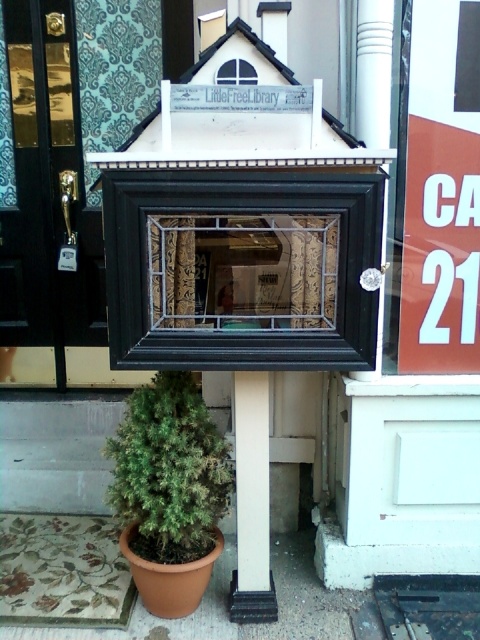
Question: Can you confirm if black wood frame at center is bigger than clear glass window at center?

Choices:
 (A) no
 (B) yes

Answer: (B)

Question: Among these points, which one is nearest to the camera?

Choices:
 (A) (182, 504)
 (B) (239, 67)
 (C) (236, 186)

Answer: (C)

Question: Which object is closer to the camera taking this photo?

Choices:
 (A) white smooth pillar at lower center
 (B) black wood frame at center
 (C) clear glass window at center
 (D) orange paper sign at right

Answer: (B)

Question: Does orange paper sign at right have a larger size compared to green matte plant at lower left?

Choices:
 (A) yes
 (B) no

Answer: (B)

Question: Is black wood frame at center to the left of white smooth pillar at lower center from the viewer's perspective?

Choices:
 (A) no
 (B) yes

Answer: (B)

Question: Among these objects, which one is nearest to the camera?

Choices:
 (A) black wood frame at center
 (B) orange paper sign at right
 (C) green matte plant at lower left
 (D) clear glass window at center

Answer: (A)